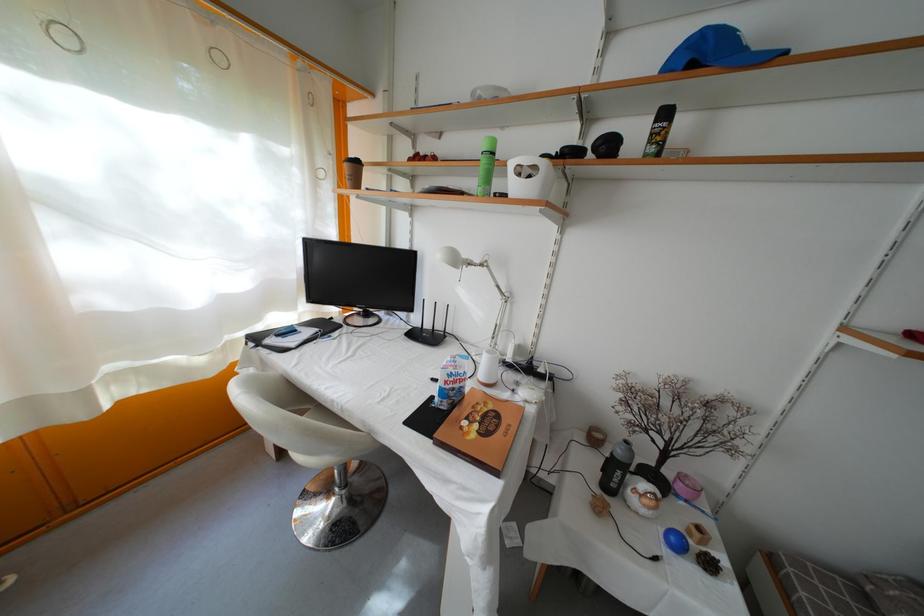
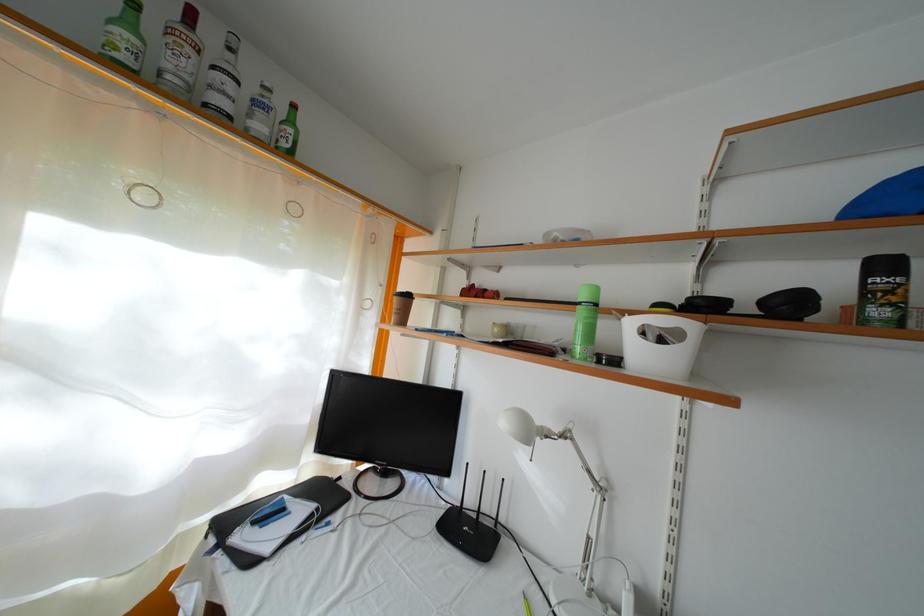
Question: The images are taken continuously from a first-person perspective. In which direction is your viewpoint rotating?

Choices:
 (A) Left
 (B) Right
 (C) Up
 (D) Down

Answer: (C)